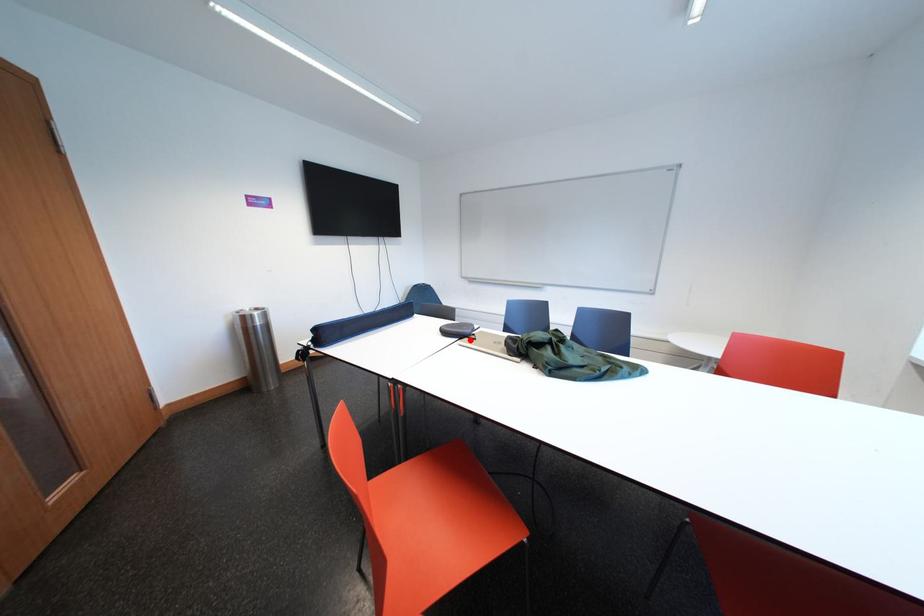
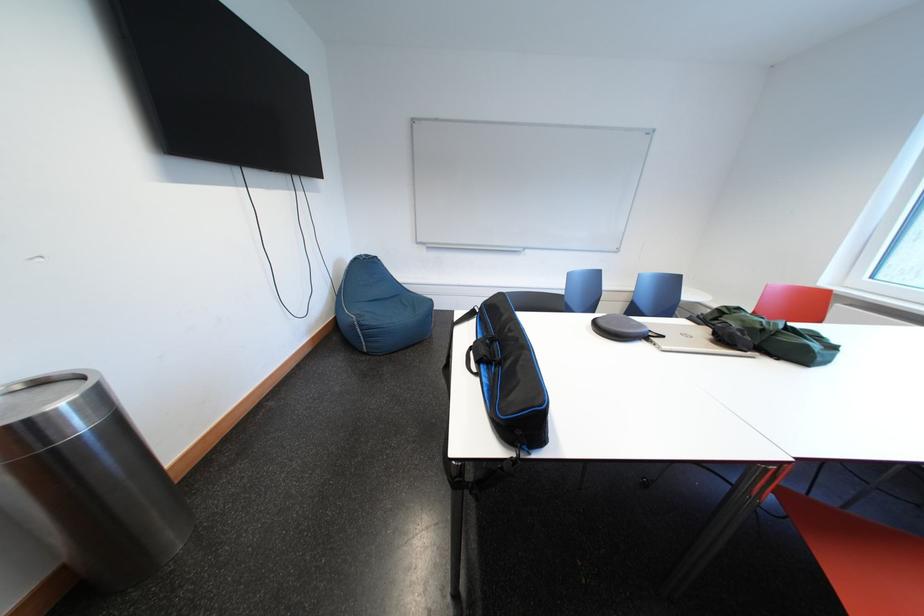
Question: I am providing you with two images of the same scene from different viewpoints. A red point is marked on the first image. At the location where the point appears in image 1, is it still visible in image 2?

Choices:
 (A) Yes
 (B) No

Answer: (A)